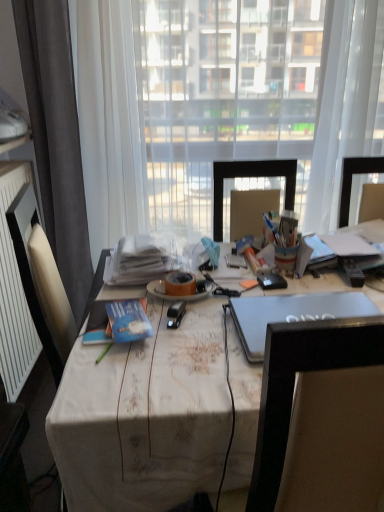
Locate an element on the screen. The height and width of the screenshot is (512, 384). vacant space situated on the left part of sleek silver laptop at center is located at coordinates (198, 349).